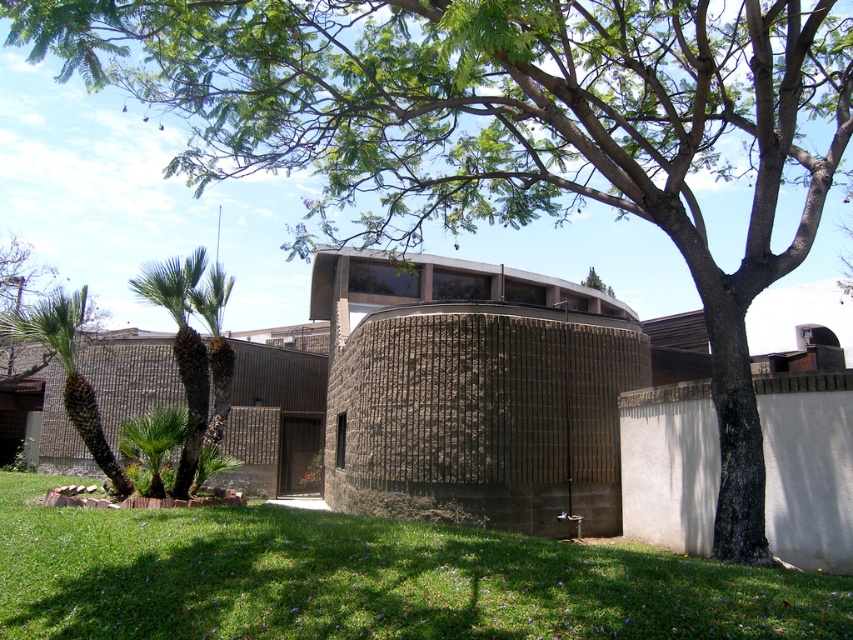
Can you confirm if green grass at lower center is bigger than green leafy palm tree at left?

Incorrect, green grass at lower center is not larger than green leafy palm tree at left.

Locate an element on the screen. This screenshot has width=853, height=640. green grass at lower center is located at coordinates (368, 579).